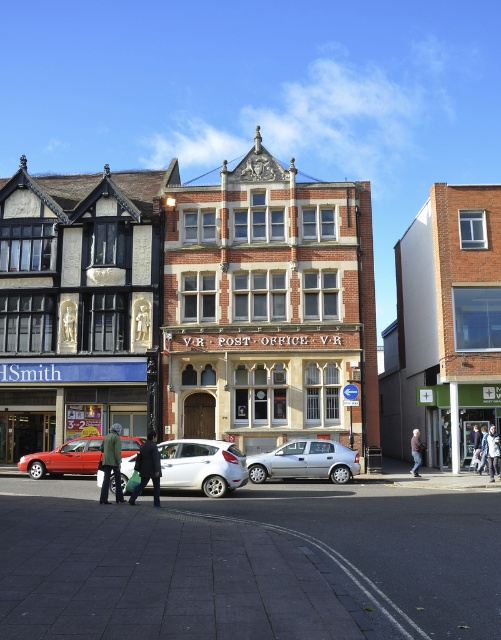
You are a tailor observing a person wearing a dark green jacket at center and dark blue jeans at center. Which clothing item appears bigger on them?

The dark green jacket at center has a larger size compared to the dark blue jeans at center, so the dark green jacket at center appears bigger.

You are a fashion designer observing the jackets in the image. Which jacket, the dark gray fabric jacket at center or the dark brown leather jacket at center, would you recommend to a client who wants a more imposing silhouette?

The dark gray fabric jacket at center is taller than the dark brown leather jacket at center, so it would create a more imposing silhouette.